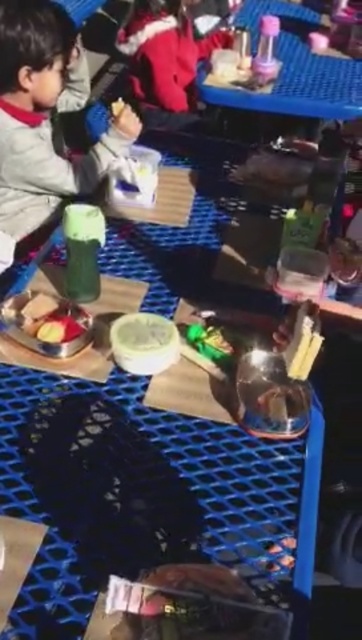
Question: Estimate the real-world distances between objects in this image. Which object is closer to the smooth plastic apple at center?

Choices:
 (A) translucent plastic tray at upper right
 (B) matte green plastic cup at upper left
 (C) matte gray jacket at left
 (D) red fleece jacket at upper center

Answer: (C)

Question: Which point is farther to the camera?

Choices:
 (A) red fleece jacket at upper center
 (B) smooth plastic apple at center

Answer: (A)

Question: Is red fleece jacket at upper center wider than matte green plastic cup at upper left?

Choices:
 (A) no
 (B) yes

Answer: (B)

Question: Estimate the real-world distances between objects in this image. Which object is farther from the smooth plastic apple at center?

Choices:
 (A) matte green plastic cup at upper left
 (B) red fleece jacket at upper center

Answer: (A)

Question: Can you confirm if matte gray jacket at left is thinner than matte green plastic cup at upper left?

Choices:
 (A) no
 (B) yes

Answer: (A)

Question: Does matte gray jacket at left appear on the right side of smooth plastic apple at center?

Choices:
 (A) yes
 (B) no

Answer: (B)